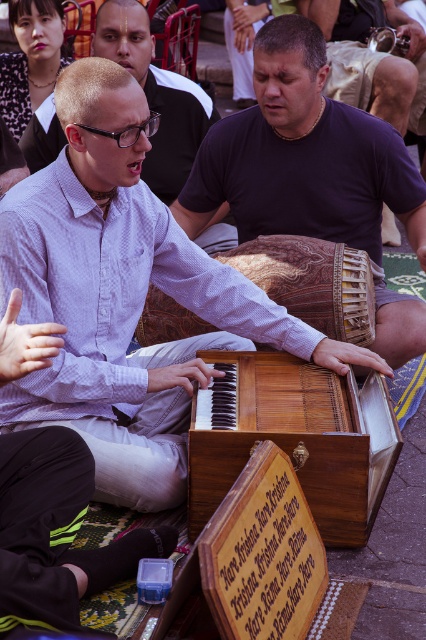
Is wooden piano at center closer to camera compared to wooden drum at center?

Yes.

Is wooden piano at center further to camera compared to wooden drum at center?

No, wooden piano at center is closer to the viewer.

Does point (212, 472) come closer to viewer compared to point (400, 52)?

Yes, point (212, 472) is closer to viewer.

I want to click on wooden piano at center, so click(301, 442).

Which is below, dark purple fabric at center or wooden piano at center?

wooden piano at center is below.

Which is above, dark purple fabric at center or wooden piano at center?

dark purple fabric at center is higher up.

At what (x,y) coordinates should I click in order to perform the action: click on dark purple fabric at center. Please return your answer as a coordinate pair (x, y). The image size is (426, 640). Looking at the image, I should click on (302, 156).

Is dark purple fabric at center further to the viewer compared to wooden drum at center?

No, dark purple fabric at center is closer to the viewer.

Does dark purple fabric at center have a lesser width compared to wooden drum at center?

Incorrect, dark purple fabric at center's width is not less than wooden drum at center's.

You are a GUI agent. You are given a task and a screenshot of the screen. Output one action in this format:
    pyautogui.click(x=<x>, y=<y>)
    Task: Click on the dark purple fabric at center
    Image resolution: width=426 pixels, height=640 pixels.
    Given the screenshot: What is the action you would take?
    pyautogui.click(x=302, y=156)

This screenshot has width=426, height=640. Find the location of `dark purple fabric at center`. dark purple fabric at center is located at coordinates (302, 156).